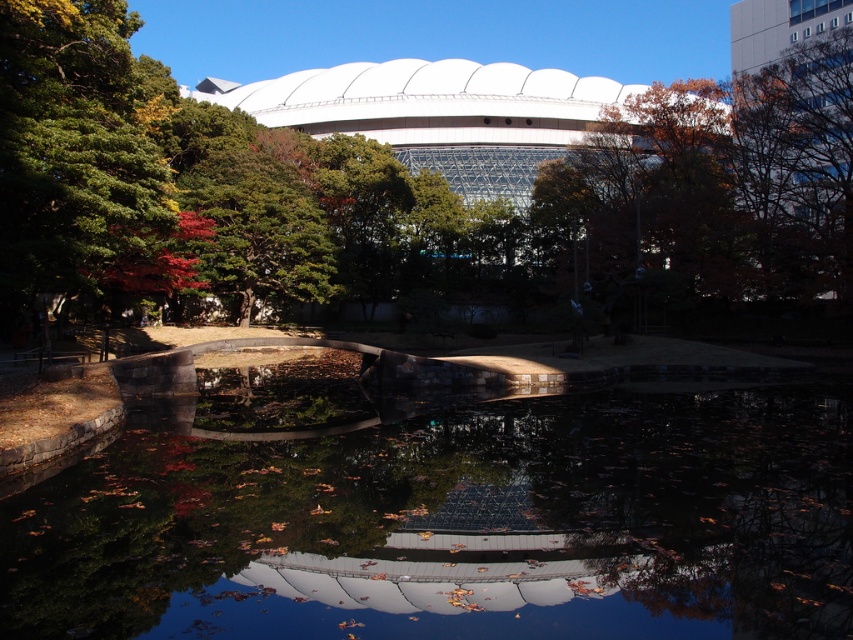
You are standing on the stone bridge and want to take a photo of the dark reflective water at center and the green leafy tree at left. Which object will appear closer to you in the photo?

The dark reflective water at center will appear closer to you in the photo because it is in front of the green leafy tree at left.

You are an architect analyzing the scene. You need to determine which object occupies more space in the image between the green leafy tree at center and the dark reflective water at center. Based on the scene description, which one is larger?

The green leafy tree at center has a larger size compared to the dark reflective water at center, so the green leafy tree at center occupies more space in the image.

You are standing on the stone bridge and see the green leafy tree at center and the green leafy tree at left. Which tree is closer to your left side?

The green leafy tree at left is closer to your left side since it is positioned to the left of the green leafy tree at center.